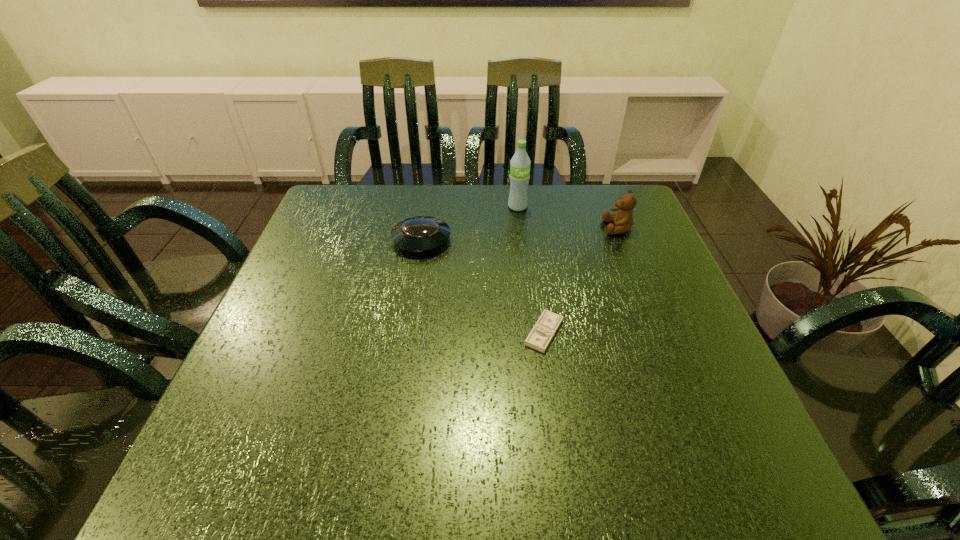
Locate an element on the screen. The height and width of the screenshot is (540, 960). vacant position located 0.390m on the front-facing side of the third shortest object is located at coordinates (457, 228).

The width and height of the screenshot is (960, 540). In order to click on free location located on the front-facing side of the third shortest object in this screenshot , I will do `click(506, 228)`.

Where is `free point located on the back of the third tallest object`? The width and height of the screenshot is (960, 540). free point located on the back of the third tallest object is located at coordinates (426, 208).

Where is `vacant position located 0.230m on the front of the nearest object`? The height and width of the screenshot is (540, 960). vacant position located 0.230m on the front of the nearest object is located at coordinates (564, 470).

The width and height of the screenshot is (960, 540). In order to click on water bottle that is positioned at the far edge in this screenshot , I will do `click(520, 163)`.

Where is `teddy bear that is at the far edge`? The image size is (960, 540). teddy bear that is at the far edge is located at coordinates (623, 220).

Locate an element on the screen. saucer present at the far edge is located at coordinates (421, 233).

You are a GUI agent. You are given a task and a screenshot of the screen. Output one action in this format:
    pyautogui.click(x=<x>, y=<y>)
    Task: Click on the object at the right edge
    This screenshot has width=960, height=540.
    Given the screenshot: What is the action you would take?
    [623, 220]

This screenshot has height=540, width=960. In order to click on object that is at the far right corner in this screenshot , I will do [x=623, y=220].

This screenshot has height=540, width=960. I want to click on free point at the far edge, so click(x=496, y=214).